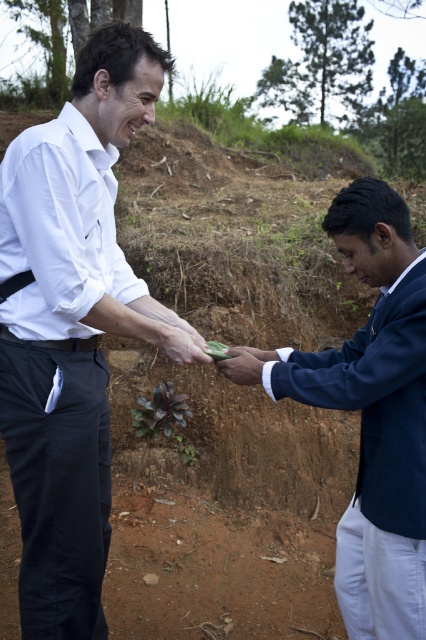
Question: From the image, what is the correct spatial relationship of white smooth dress shirt at center in relation to black leather belt at center?

Choices:
 (A) below
 (B) above

Answer: (B)

Question: Which object is farther from the camera taking this photo?

Choices:
 (A) navy blue jacket at center
 (B) white smooth dress shirt at center
 (C) white matte shirt at center
 (D) black leather belt at center

Answer: (D)

Question: Is white matte shirt at center to the left of smooth skin hand at center from the viewer's perspective?

Choices:
 (A) yes
 (B) no

Answer: (A)

Question: Among these points, which one is nearest to the camera?

Choices:
 (A) (5, 266)
 (B) (268, 358)
 (C) (23, 353)

Answer: (C)

Question: Based on their relative distances, which object is farther from the navy blue jacket at center?

Choices:
 (A) black leather belt at center
 (B) smooth skin hand at center

Answer: (A)

Question: Does white matte shirt at center have a smaller size compared to matte green wallet at center?

Choices:
 (A) yes
 (B) no

Answer: (B)